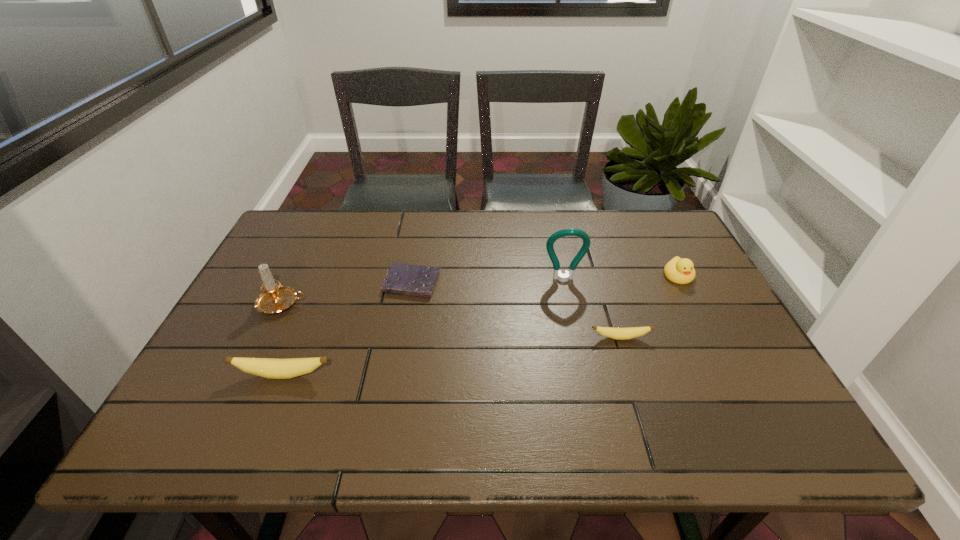
Please determine a free point for an extra banana to ensure balance. Please provide its 2D coordinates. Your answer should be formatted as a tuple, i.e. [(x, y)], where the tuple contains the x and y coordinates of a point satisfying the conditions above.

[(459, 356)]